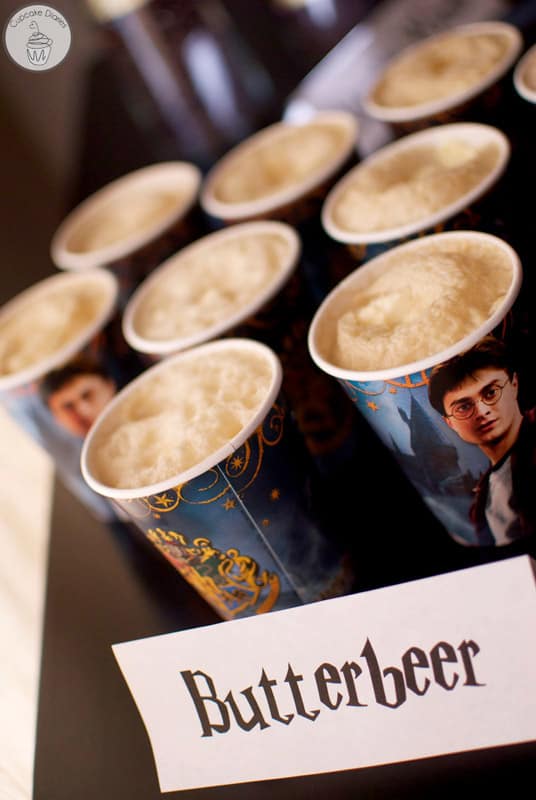
Identify the location of cup. This screenshot has width=536, height=800. (253, 514), (440, 429), (58, 402), (215, 305), (402, 209), (281, 153), (118, 208), (424, 72), (525, 88).